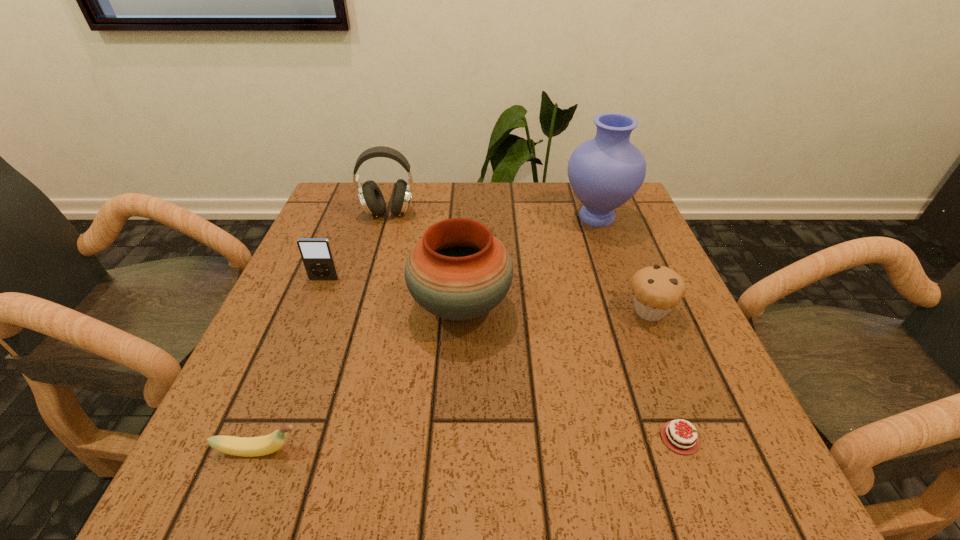
This screenshot has width=960, height=540. I want to click on banana situated at the left edge, so click(263, 445).

Identify the location of vase that is at the right edge. (604, 172).

Locate an element on the screen. muffin present at the right edge is located at coordinates (657, 290).

Identify the location of chocolate cake located at the right edge. (684, 445).

Where is `object that is at the far left corner`? The image size is (960, 540). object that is at the far left corner is located at coordinates (371, 198).

Where is `object that is at the near left corner`? The image size is (960, 540). object that is at the near left corner is located at coordinates (263, 445).

The height and width of the screenshot is (540, 960). I want to click on object at the far right corner, so click(604, 172).

At what (x,y) coordinates should I click in order to perform the action: click on object that is at the near right corner. Please return your answer as a coordinate pair (x, y). The image size is (960, 540). Looking at the image, I should click on [684, 445].

This screenshot has width=960, height=540. Find the location of `vacant space at the far edge of the desktop`. vacant space at the far edge of the desktop is located at coordinates coord(390,195).

In the image, there is a desktop. Where is `vacant space at the near edge`? vacant space at the near edge is located at coordinates (382, 484).